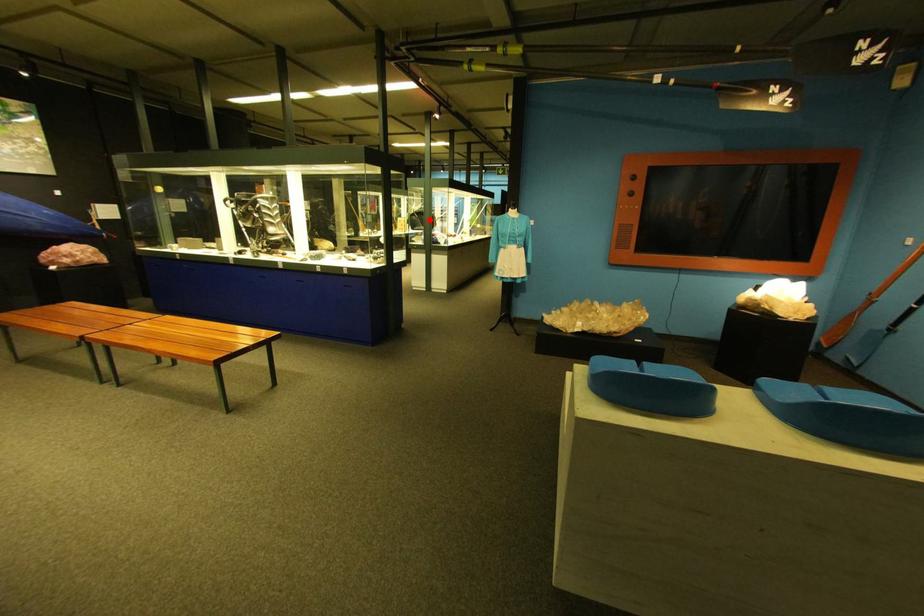
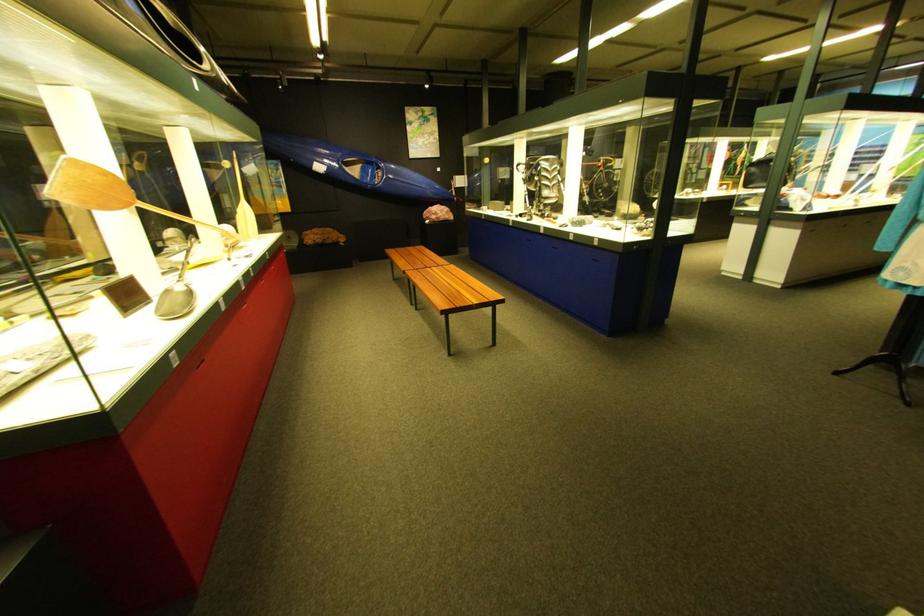
Where in the second image is the point corresponding to the highlighted location from the first image?

(769, 172)